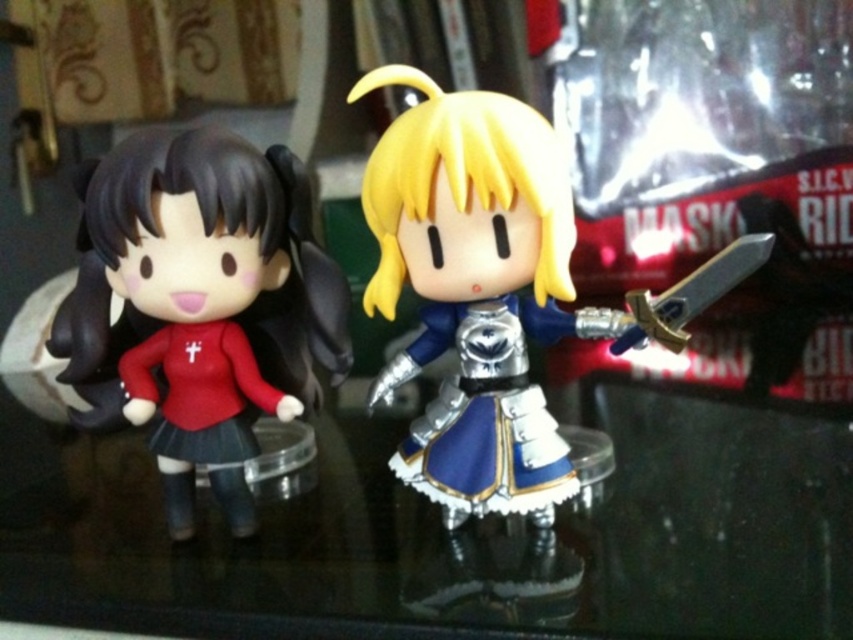
Does matte red dress at left appear on the left side of shiny silver sword at right?

Yes, matte red dress at left is to the left of shiny silver sword at right.

Does matte red dress at left have a lesser height compared to shiny silver sword at right?

In fact, matte red dress at left may be taller than shiny silver sword at right.

You are a GUI agent. You are given a task and a screenshot of the screen. Output one action in this format:
    pyautogui.click(x=<x>, y=<y>)
    Task: Click on the matte red dress at left
    This screenshot has height=640, width=853.
    Given the screenshot: What is the action you would take?
    pyautogui.click(x=202, y=241)

Which is in front, point (479, 193) or point (137, 232)?

Positioned in front is point (479, 193).

Measure the distance between shiny silver armor at center and camera.

The distance of shiny silver armor at center from camera is 31.11 inches.

Image resolution: width=853 pixels, height=640 pixels. I want to click on shiny silver armor at center, so click(x=494, y=291).

At what (x,y) coordinates should I click in order to perform the action: click on shiny silver armor at center. Please return your answer as a coordinate pair (x, y). This screenshot has width=853, height=640. Looking at the image, I should click on (494, 291).

Between shiny silver armor at center and shiny silver sword at right, which one has more height?

shiny silver armor at center is taller.

What are the coordinates of `shiny silver armor at center` in the screenshot? It's located at (494, 291).